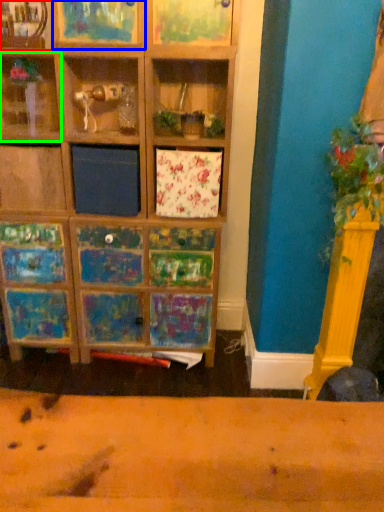
Question: Estimate the real-world distances between objects in this image. Which object is farther from shelf (highlighted by a red box), shelf (highlighted by a blue box) or shelf (highlighted by a green box)?

Choices:
 (A) shelf
 (B) shelf

Answer: (B)